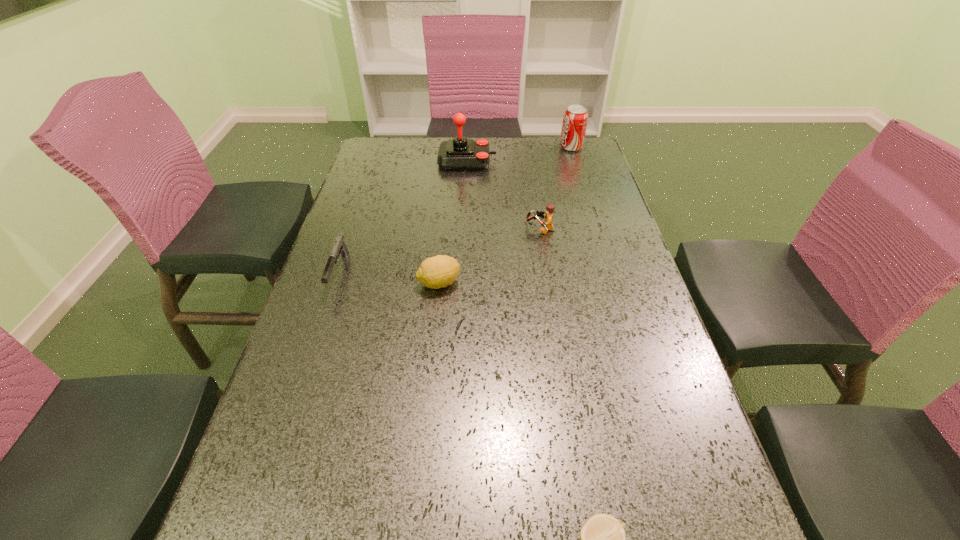
Locate an element on the screen. Image resolution: width=960 pixels, height=540 pixels. blank space located holding a crossbow in the hands of the third tallest object is located at coordinates (497, 230).

You are a GUI agent. You are given a task and a screenshot of the screen. Output one action in this format:
    pyautogui.click(x=<x>, y=<y>)
    Task: Click on the vacant space situated holding a crossbow in the hands of the third tallest object
    
    Given the screenshot: What is the action you would take?
    pyautogui.click(x=476, y=230)

At what (x,y) coordinates should I click in order to perform the action: click on vacant space located 0.260m holding a crossbow in the hands of the third tallest object. Please return your answer as a coordinate pair (x, y). The image size is (960, 540). Looking at the image, I should click on (434, 230).

Locate an element on the screen. This screenshot has width=960, height=540. vacant position located 0.390m at the stem end of the taller lemon is located at coordinates (617, 283).

Identify the location of vacant space located at the muzzle end of the gun. The image size is (960, 540). (287, 428).

You are a GUI agent. You are given a task and a screenshot of the screen. Output one action in this format:
    pyautogui.click(x=<x>, y=<y>)
    Task: Click on the joystick located at the far edge
    This screenshot has height=540, width=960.
    Given the screenshot: What is the action you would take?
    pyautogui.click(x=459, y=153)

Identify the location of soda that is at the far edge. Image resolution: width=960 pixels, height=540 pixels. (575, 119).

Identify the location of object at the left edge. (339, 247).

At what (x,y) coordinates should I click in order to perform the action: click on object present at the right edge. Please return your answer as a coordinate pair (x, y). Looking at the image, I should click on (575, 119).

What are the coordinates of `object present at the far right corner` in the screenshot? It's located at [x=575, y=119].